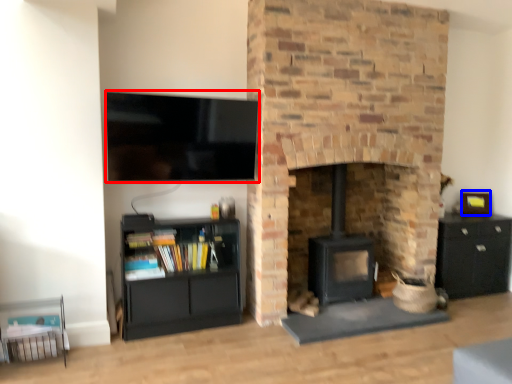
Question: Among these objects, which one is farthest to the camera, television (highlighted by a red box) or picture frame (highlighted by a blue box)?

Choices:
 (A) television
 (B) picture frame

Answer: (B)